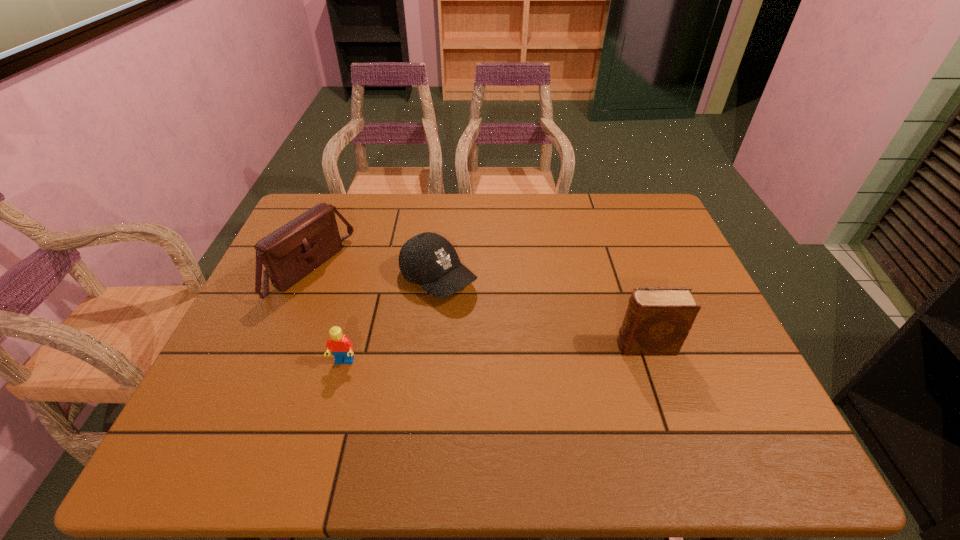
Locate an element on the screen. free spot on the desktop that is between the Lego and the diary and is positioned on the front flap of the shoulder bag is located at coordinates (484, 354).

Image resolution: width=960 pixels, height=540 pixels. Identify the location of vacant spot on the desktop that is between the Lego and the diary and is positioned on the front-facing side of the second object from right to left. (531, 352).